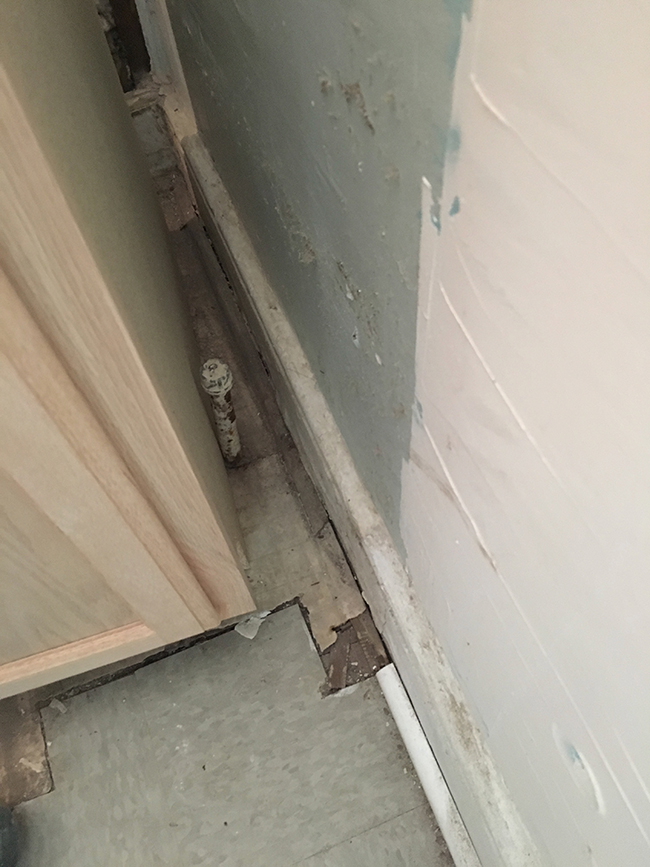
Identify the location of brown dirt on floor where tile is missing. (350, 650).